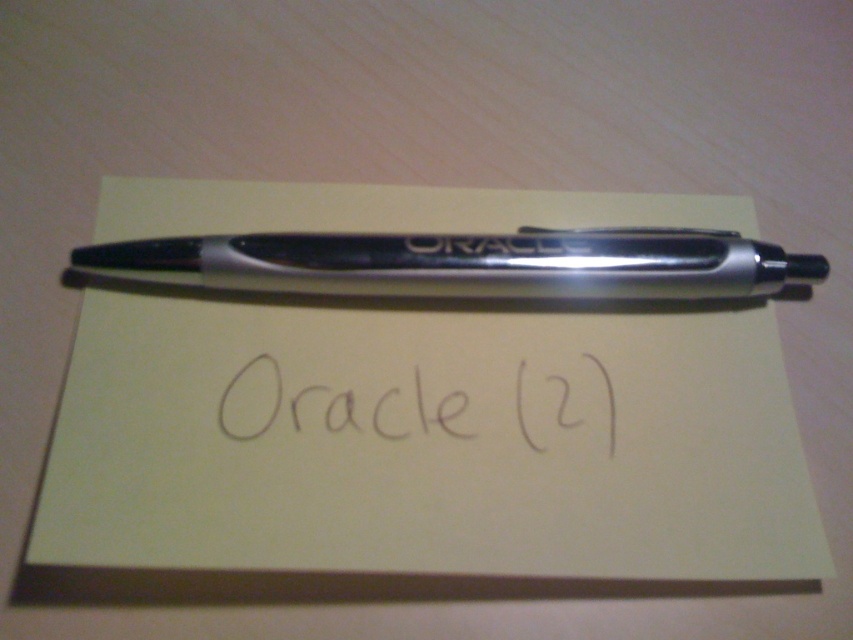
Based on the photo, you are looking at the image of a pen on a sticky note. There are two points marked in the image. Which point is closer to you, point (73, 522) or point (239, 388)?

Point (73, 522) is closer to the viewer than point (239, 388).

You are trying to write a note and see the yellow paper at center and the metallic silver pen at center. Which object should you pick up first to start writing?

You should pick up the metallic silver pen at center first because the yellow paper at center is below it, so the pen is on top and easier to access.

You are an office worker who needs to check the text on the yellow paper at center and the black ink writing at center. Which one can you read more clearly from your current position?

The yellow paper at center is closer to the viewer than the black ink writing at center, so you can read the yellow paper at center more clearly.